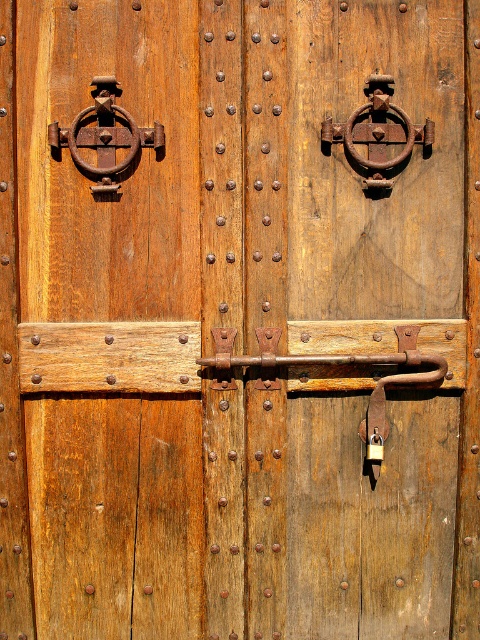
Question: Which point is closer to the camera taking this photo?

Choices:
 (A) (139, 102)
 (B) (381, 86)
 (C) (115, 140)

Answer: (C)

Question: Estimate the real-world distances between objects in this image. Which object is farther from the rusty metal ring at upper center?

Choices:
 (A) rustic wood knocker at upper left
 (B) rusty metal ring at upper left

Answer: (A)

Question: Is rustic wood knocker at upper left to the left of rusty metal ring at upper left from the viewer's perspective?

Choices:
 (A) yes
 (B) no

Answer: (B)

Question: Which is farther from the rustic wood knocker at upper left?

Choices:
 (A) rusty metal ring at upper left
 (B) rusty metal ring at upper center

Answer: (B)

Question: Is rustic wood knocker at upper left wider than rusty metal ring at upper left?

Choices:
 (A) no
 (B) yes

Answer: (B)

Question: Is rusty metal ring at upper center positioned at the back of rusty metal ring at upper left?

Choices:
 (A) no
 (B) yes

Answer: (B)